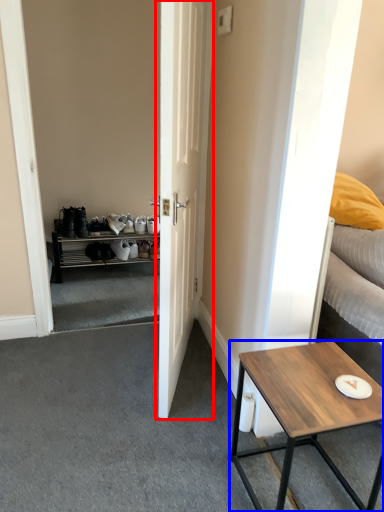
Question: Which of the following is the farthest to the observer, door (highlighted by a red box) or coffee table (highlighted by a blue box)?

Choices:
 (A) door
 (B) coffee table

Answer: (A)